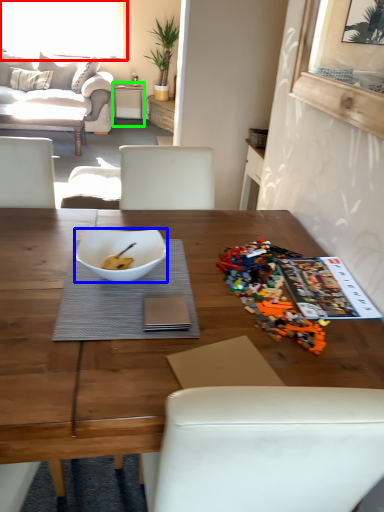
Question: Which object is positioned closest to window (highlighted by a red box)? Select from bowl (highlighted by a blue box) and table (highlighted by a green box).

Choices:
 (A) bowl
 (B) table

Answer: (B)